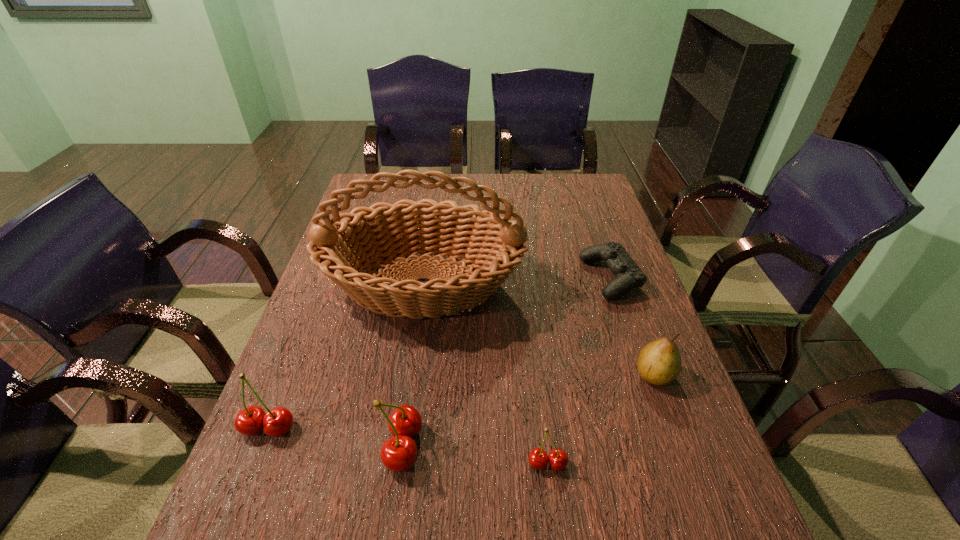
Identify the location of vacant area at the left edge. (325, 352).

At what (x,y) coordinates should I click in order to perform the action: click on vacant space at the far left corner. Please return your answer as a coordinate pair (x, y). Image resolution: width=960 pixels, height=540 pixels. Looking at the image, I should click on (401, 181).

In the image, there is a desktop. Identify the location of vacant space at the far right corner. This screenshot has height=540, width=960. (569, 184).

In the image, there is a desktop. Identify the location of blank space at the near right corner. This screenshot has width=960, height=540. (709, 470).

Find the location of a particular element. This screenshot has width=960, height=540. vacant point located between the leftmost cherry and the control is located at coordinates (440, 353).

Identify the location of empty space between the rightmost cherry and the second cherry from left to right. This screenshot has width=960, height=540. (475, 454).

This screenshot has height=540, width=960. Identify the location of free space between the second cherry from right to left and the basket. (414, 365).

Find the location of `vacant region between the shortest object and the third tallest object`. vacant region between the shortest object and the third tallest object is located at coordinates (440, 353).

Find the location of a particular element. The image size is (960, 540). free space between the pear and the third tallest object is located at coordinates (462, 401).

Identify the location of free space between the tallest object and the fourth tallest object. The image size is (960, 540). (539, 329).